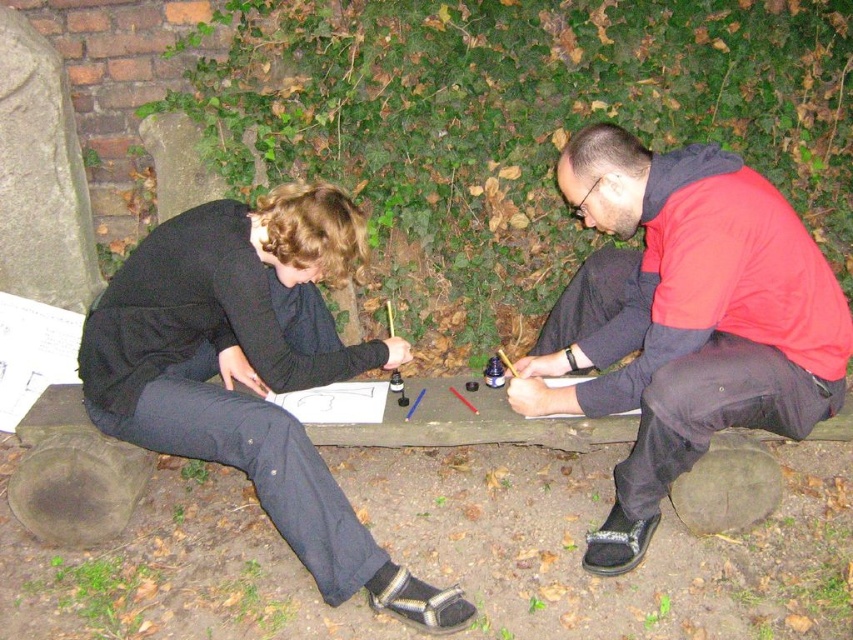
Question: From the image, what is the correct spatial relationship of red fabric jacket at right in relation to black matte pants at lower left?

Choices:
 (A) above
 (B) below

Answer: (A)

Question: Which point appears farthest from the camera in this image?

Choices:
 (A) (581, 317)
 (B) (680, 227)

Answer: (A)

Question: Estimate the real-world distances between objects in this image. Which object is closer to the black matte pants at lower left?

Choices:
 (A) red fabric jacket at right
 (B) black fabric jacket at center

Answer: (B)

Question: Can you confirm if red fabric jacket at right is positioned above black matte pants at lower left?

Choices:
 (A) yes
 (B) no

Answer: (A)

Question: Can you confirm if red fabric jacket at right is positioned above black matte pants at lower left?

Choices:
 (A) no
 (B) yes

Answer: (B)

Question: Which object is positioned farthest from the red fabric jacket at right?

Choices:
 (A) black matte pants at lower left
 (B) black fabric jacket at center

Answer: (A)